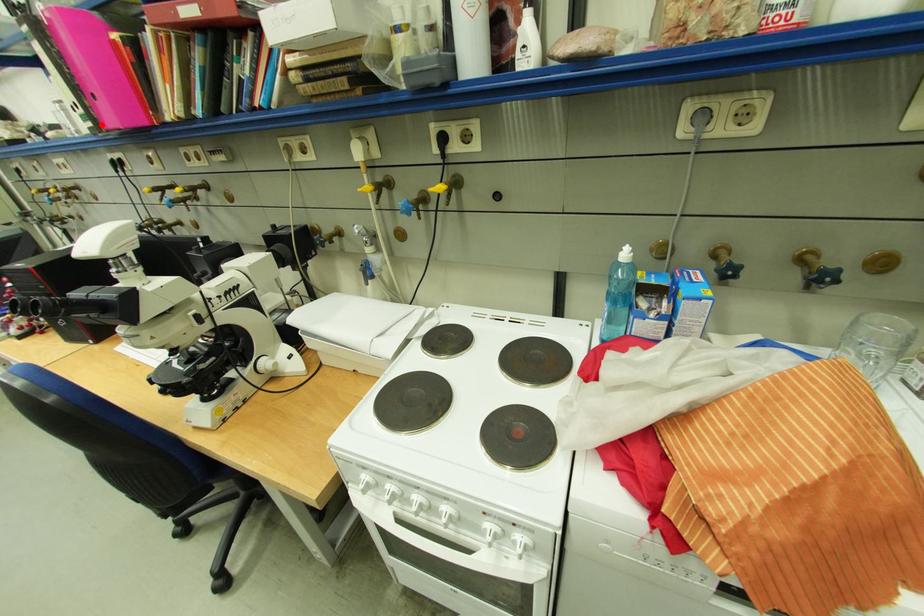
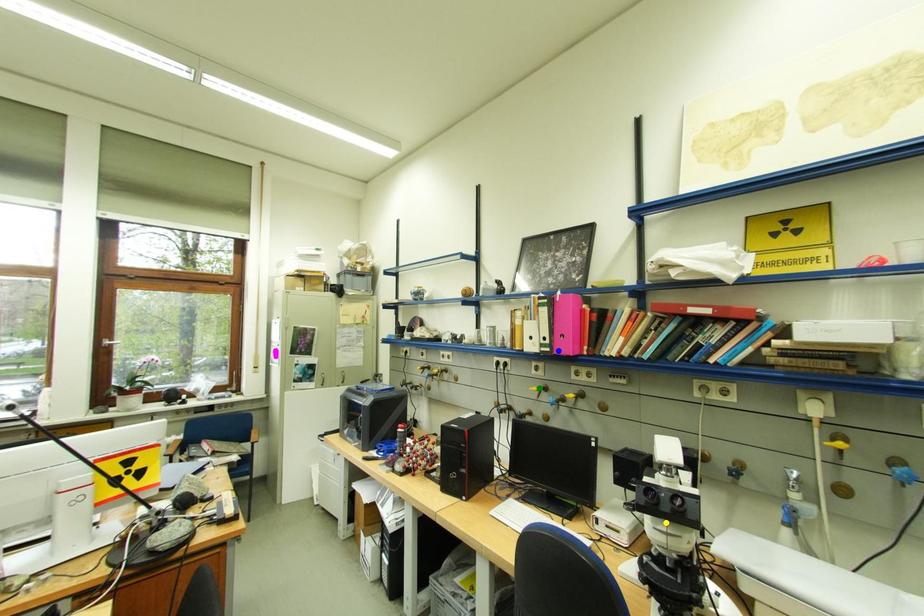
Question: I am providing you with two images of the same scene from different viewpoints. A red point is marked on the first image. You are given multiple points on the second image. Can you choose the point in image 2 that corresponds to the point in image 1?

Choices:
 (A) green point
 (B) blue point
 (C) yellow point

Answer: (B)